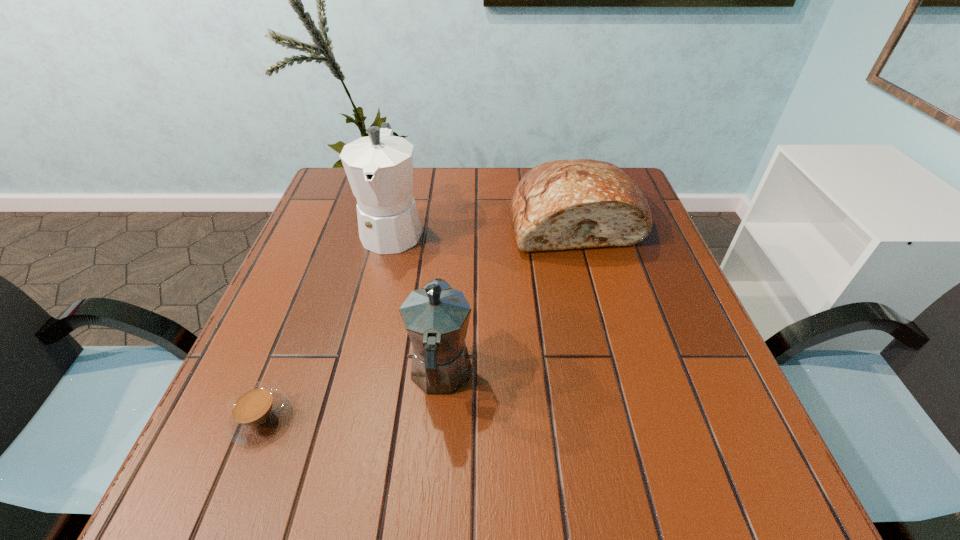
Identify the location of the third object from right to left. This screenshot has height=540, width=960. (379, 167).

The height and width of the screenshot is (540, 960). Find the location of `the taller coffeepot`. the taller coffeepot is located at coordinates (379, 167).

Identify the location of the shorter coffeepot. The image size is (960, 540). (436, 317).

Find the location of a particular element. The image size is (960, 540). the nearer coffeepot is located at coordinates (436, 317).

Identify the location of the second shortest object. The image size is (960, 540). (577, 203).

Where is `the rightmost object`? This screenshot has height=540, width=960. the rightmost object is located at coordinates (577, 203).

What are the coordinates of `cappuccino` in the screenshot? It's located at (256, 413).

The width and height of the screenshot is (960, 540). Identify the location of the leftmost object. (256, 413).

Find the location of a particular element. The width and height of the screenshot is (960, 540). vacant region located 0.110m at the spout of the taller coffeepot is located at coordinates (376, 297).

Find the location of a particular element. free spot located 0.100m on the pouring side of the shorter coffeepot is located at coordinates (446, 299).